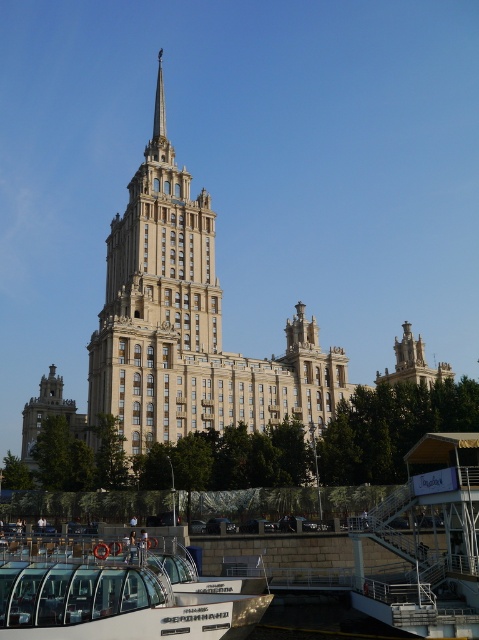
You are a tourist standing at the waterfront and want to take a photo of both the beige stone building at center and the matte gold tower at lower left. Which one should you zoom in on more to ensure both are visible in the frame?

Since the beige stone building at center is much taller than the matte gold tower at lower left, you should zoom in more on the beige stone building at center to ensure both fit in the frame.

You are a tour guide leading a group to the boat. The boat is 120 feet long. Can the boat fit in the space between the white glass boat at lower left and the matte gold tower at lower left?

The white glass boat at lower left is 119.19 feet from the matte gold tower at lower left. Since the boat is 120 feet long, it cannot fit in the space between them as the distance is slightly shorter than the boat.